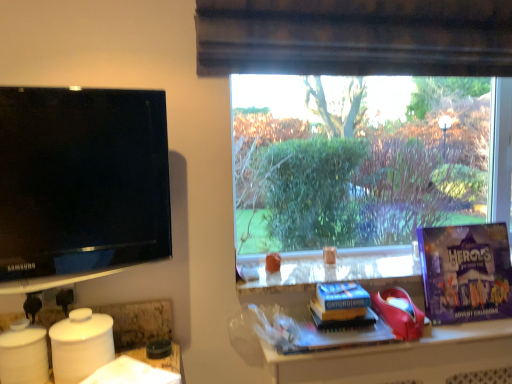
This screenshot has height=384, width=512. What are the coordinates of `empty space that is ontop of matte black tv at left` in the screenshot? It's located at (75, 92).